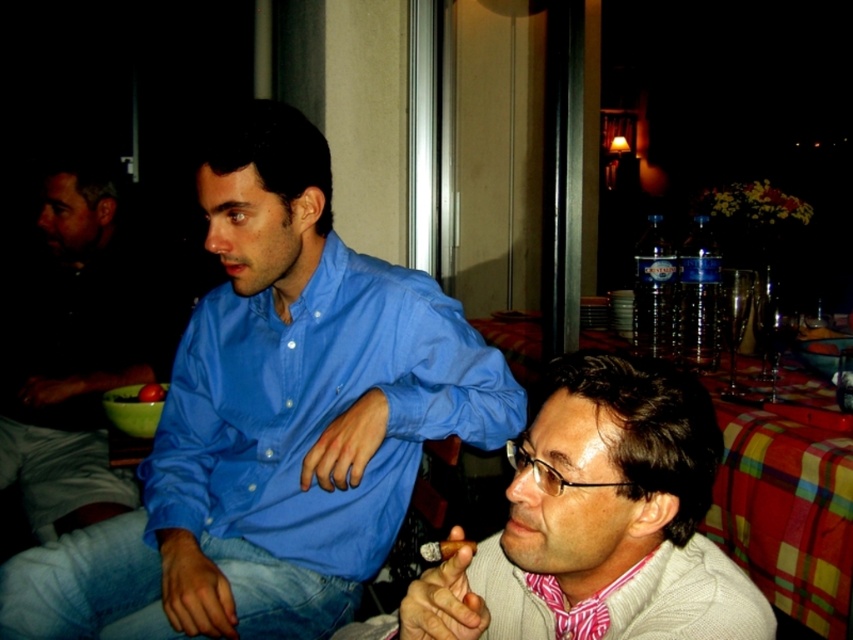
You are a photographer trying to capture the man in the dark blue shirt at left without including the plaid fabric tablecloth at lower right in the frame. Is this possible given their current positions?

The dark blue shirt at left is positioned over the plaid fabric tablecloth at lower right, so it would be difficult to capture the shirt without including the tablecloth in the frame.